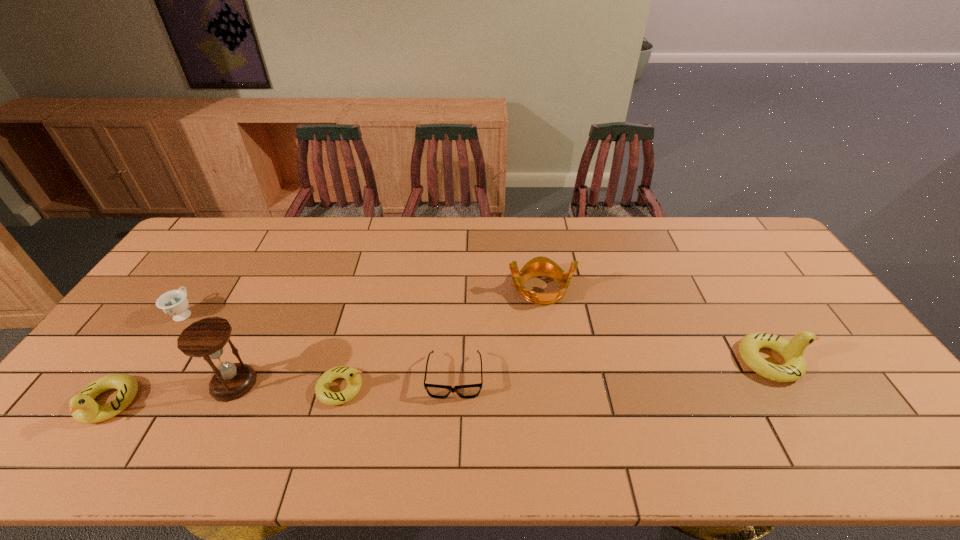
In order to click on hourglass present at the near edge in this screenshot , I will do `click(206, 338)`.

Where is `sunglasses that is at the near edge`? sunglasses that is at the near edge is located at coordinates (473, 390).

At what (x,y) coordinates should I click in order to perform the action: click on duckling that is at the left edge. Please return your answer as a coordinate pair (x, y). This screenshot has height=540, width=960. Looking at the image, I should click on (83, 407).

Where is `teacup that is at the left edge`? The height and width of the screenshot is (540, 960). teacup that is at the left edge is located at coordinates (174, 303).

Identify the location of object that is at the right edge. (794, 368).

The width and height of the screenshot is (960, 540). Identify the location of object that is at the near left corner. (83, 407).

Where is `vacant space at the far edge`? This screenshot has height=540, width=960. vacant space at the far edge is located at coordinates (607, 233).

Find the location of a particular element. vacant space at the near edge of the desktop is located at coordinates (370, 415).

In the image, there is a desktop. In order to click on vacant space at the left edge in this screenshot , I will do (x=127, y=354).

What are the coordinates of `free space at the right edge of the desktop` in the screenshot? It's located at (848, 340).